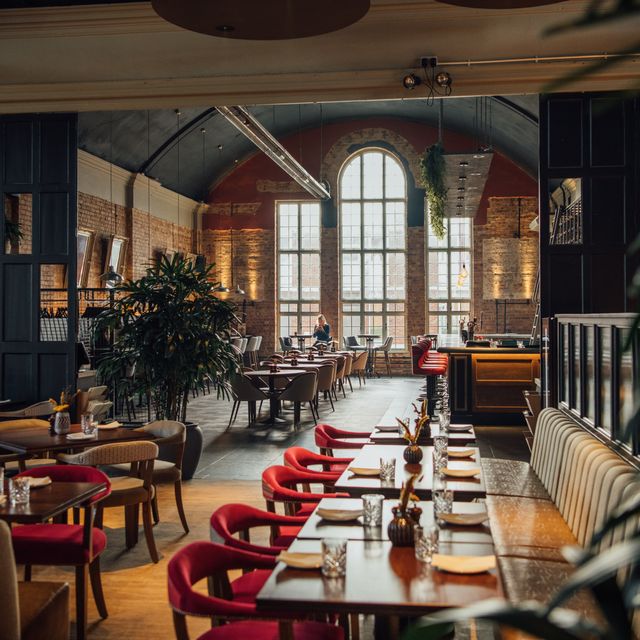
Where is `dark vase`? The image size is (640, 640). dark vase is located at coordinates (194, 448).